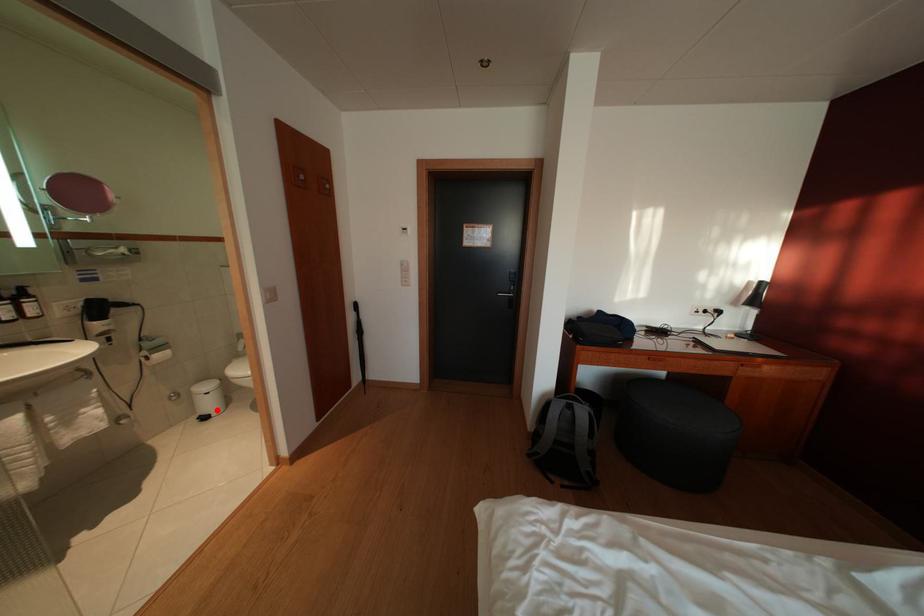
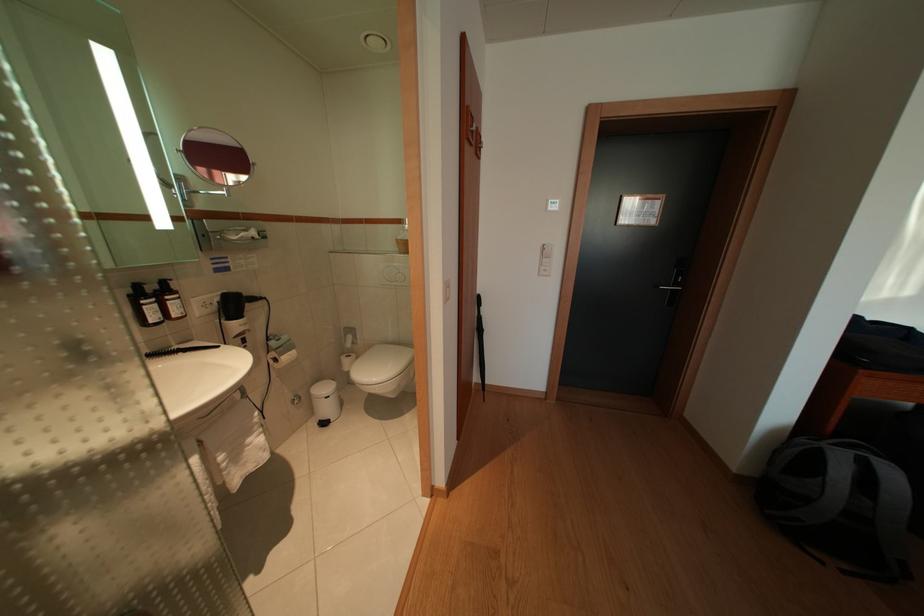
Question: I am providing you with two images of the same scene from different viewpoints. In image1, a red point is highlighted. Considering the same 3D point in image2, which of the following is correct?

Choices:
 (A) It is closer
 (B) It is farther

Answer: (B)